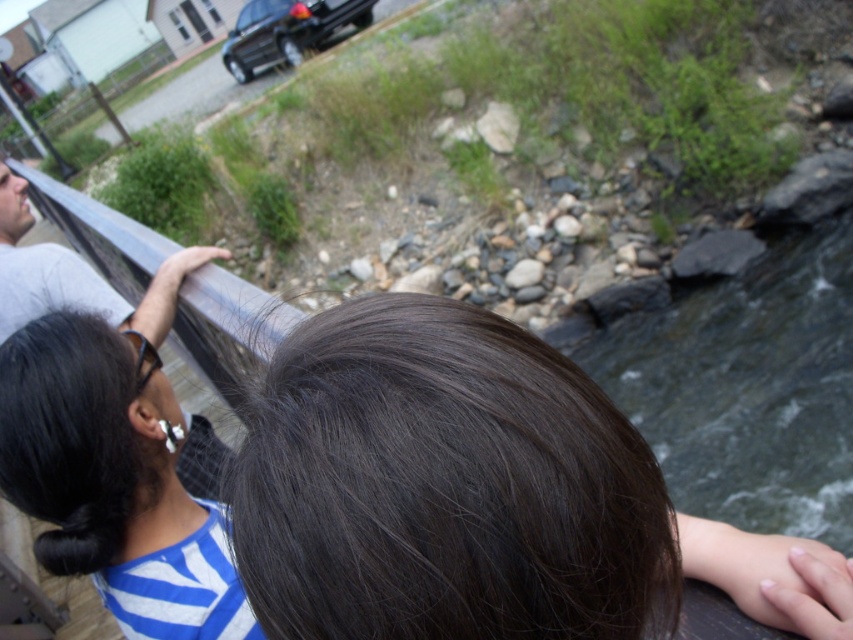
Question: Observing the image, what is the correct spatial positioning of dark brown hair at center in reference to gray fabric shirt at left?

Choices:
 (A) above
 (B) below

Answer: (B)

Question: Which point is closer to the camera?

Choices:
 (A) (581, 420)
 (B) (170, 257)
 (C) (167, 449)

Answer: (A)

Question: Which object appears farthest from the camera in this image?

Choices:
 (A) gray fabric shirt at left
 (B) black matte hair at upper left

Answer: (A)

Question: Among these objects, which one is farthest from the camera?

Choices:
 (A) dark brown hair at center
 (B) gray fabric shirt at left

Answer: (B)

Question: Considering the relative positions of dark brown hair at center and black matte hair at upper left in the image provided, where is dark brown hair at center located with respect to black matte hair at upper left?

Choices:
 (A) above
 (B) below

Answer: (A)

Question: Does dark brown hair at center appear over black matte hair at upper left?

Choices:
 (A) no
 (B) yes

Answer: (B)